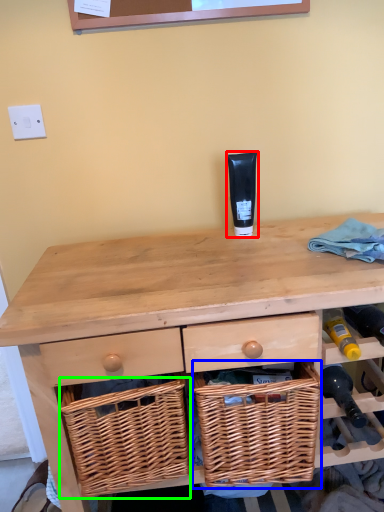
Question: Which is nearer to the toiletry (highlighted by a red box)? picnic basket (highlighted by a blue box) or basket (highlighted by a green box).

Choices:
 (A) picnic basket
 (B) basket

Answer: (A)